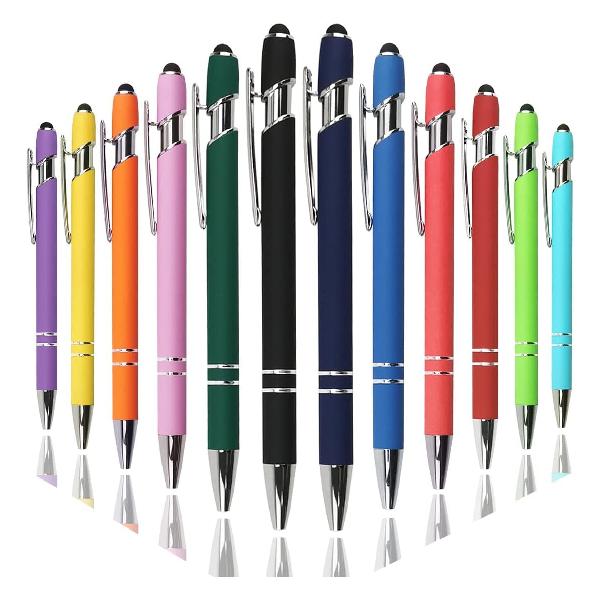
Find the location of a particular element. The height and width of the screenshot is (600, 600). pens on right side is located at coordinates (340, 268), (391, 269), (443, 271), (489, 270), (529, 277), (561, 276).